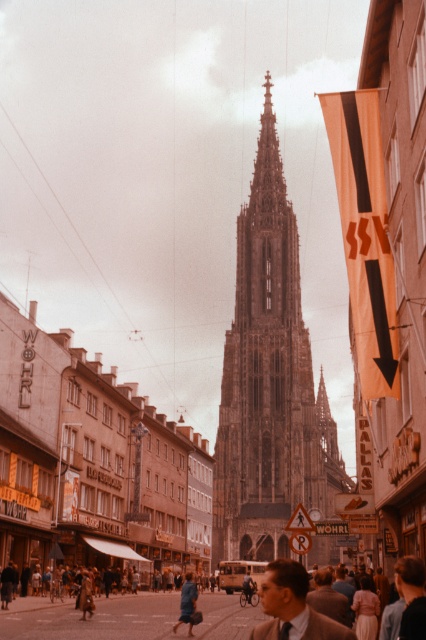
You are a tourist standing on the street in front of the cathedral. You see the brown stone tower at center and the blue fabric coat at lower center. Which object is positioned to the right of the other?

The brown stone tower at center is to the right of the blue fabric coat at lower center.

You are a tourist standing on the street in front of the cathedral. You see two points marked on the ground. One is at point (281, 502) and the other at point (189, 604). Which point is closer to you?

Point (281, 502) is closer to you because it is further to the viewer than point (189, 604).